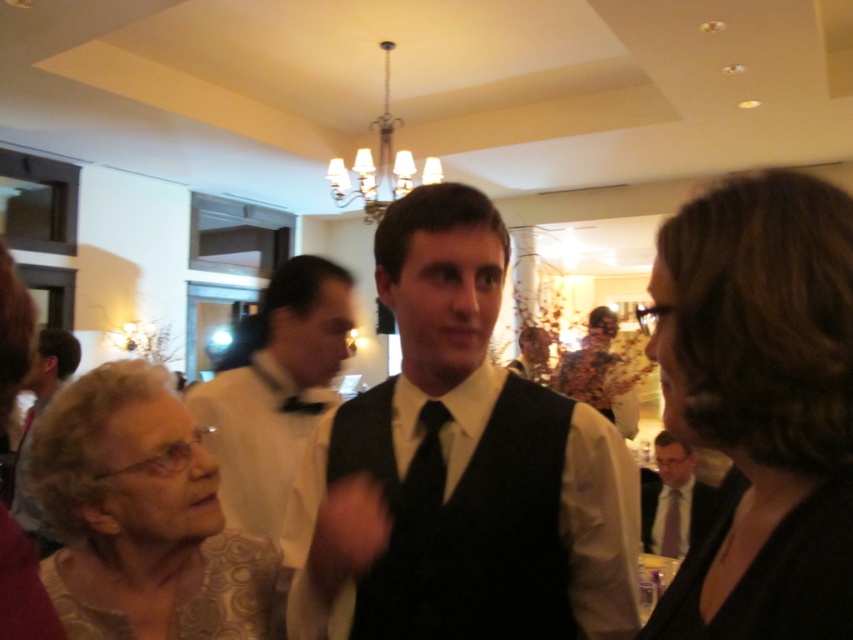
Question: Among these objects, which one is farthest from the camera?

Choices:
 (A) patterned fabric dress at lower left
 (B) gold patterned dress at lower left
 (C) matte black vest at lower left

Answer: (C)

Question: Is dark brown hair at upper right further to the viewer compared to black satin bow tie at center?

Choices:
 (A) yes
 (B) no

Answer: (B)

Question: Estimate the real-world distances between objects in this image. Which object is closer to the black satin bow tie at center?

Choices:
 (A) matte black dress at center
 (B) gold patterned dress at lower left
 (C) black silk tie at center

Answer: (B)

Question: Is the position of matte black vest at lower left more distant than that of black satin bow tie at center?

Choices:
 (A) yes
 (B) no

Answer: (A)

Question: Which of the following is the farthest from the observer?

Choices:
 (A) black silk tie at center
 (B) matte black vest at lower left
 (C) matte black tie at center
 (D) black satin bow tie at center

Answer: (C)

Question: Does patterned fabric dress at lower left appear over matte black tie at center?

Choices:
 (A) no
 (B) yes

Answer: (B)